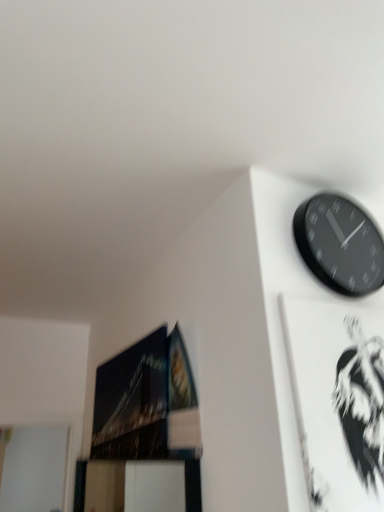
Measure the distance between black matte wall clock at upper right and camera.

The distance of black matte wall clock at upper right from camera is 1.35 meters.

At what (x,y) coordinates should I click in order to perform the action: click on black matte wall clock at upper right. Please return your answer as a coordinate pair (x, y). The height and width of the screenshot is (512, 384). Looking at the image, I should click on (340, 244).

Describe the element at coordinates (340, 244) in the screenshot. I see `black matte wall clock at upper right` at that location.

I want to click on black matte wall clock at upper right, so click(x=340, y=244).